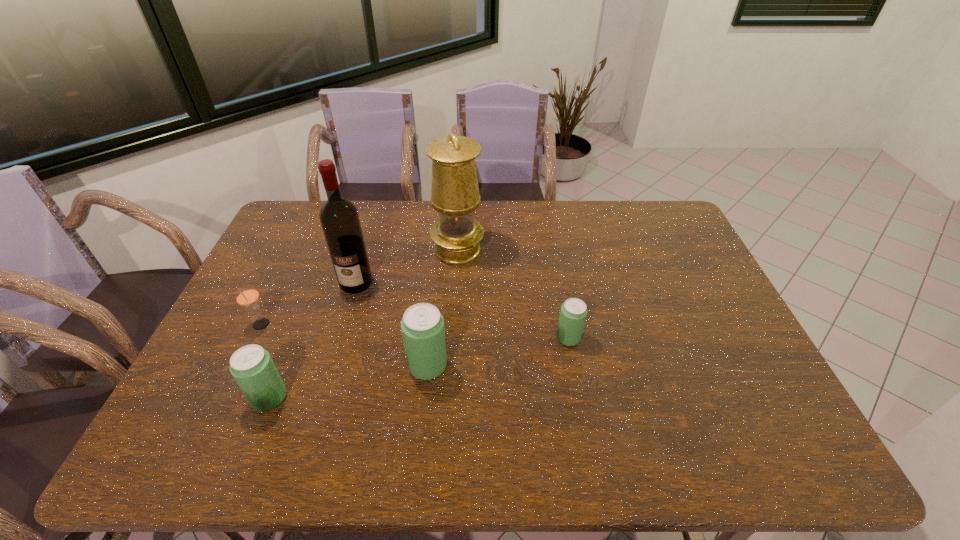
Where is `blank space located on the right of the tallest soda`? Image resolution: width=960 pixels, height=540 pixels. blank space located on the right of the tallest soda is located at coordinates (585, 366).

This screenshot has width=960, height=540. In order to click on free location located on the left of the rightmost soda in this screenshot , I will do `click(420, 338)`.

In order to click on blank space located on the right of the oil lamp in this screenshot , I will do `click(584, 250)`.

Find the location of a particular element. This screenshot has height=540, width=960. free spot located on the front and back of the third object from left to right is located at coordinates (349, 307).

I want to click on free spot located 0.280m on the right of the straw, so click(369, 325).

You are a GUI agent. You are given a task and a screenshot of the screen. Output one action in this format:
    pyautogui.click(x=<x>, y=<y>)
    Task: Click on the object located at the far edge
    This screenshot has width=960, height=540.
    Given the screenshot: What is the action you would take?
    coord(455,195)

Locate an element on the screen. object at the near edge is located at coordinates (253, 369).

The height and width of the screenshot is (540, 960). Identify the location of object that is at the left edge. (247, 296).

This screenshot has width=960, height=540. Identify the location of free spot at the far edge of the desktop. (599, 211).

Locate an element on the screen. vacant space at the near edge is located at coordinates (x=579, y=416).